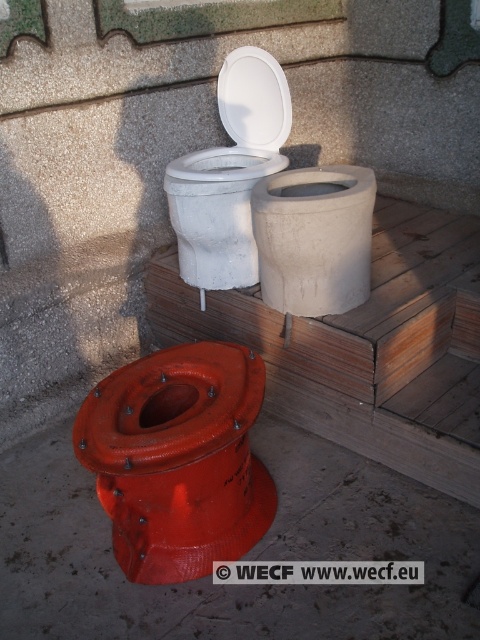
Question: Is orange glossy toilet bowl at lower center positioned behind white glossy toilet lid at upper center?

Choices:
 (A) no
 (B) yes

Answer: (A)

Question: In this image, where is white matte toilet bowl at upper center located relative to white glossy toilet lid at upper center?

Choices:
 (A) above
 (B) below

Answer: (B)

Question: Which point is farther to the camera?

Choices:
 (A) matte concrete toilet bowl at center
 (B) white glossy toilet lid at upper center
 (C) white matte toilet bowl at upper center

Answer: (B)

Question: Can you confirm if matte concrete toilet bowl at center is wider than white matte toilet bowl at upper center?

Choices:
 (A) yes
 (B) no

Answer: (B)

Question: Based on their relative distances, which object is nearer to the white matte toilet bowl at upper center?

Choices:
 (A) orange glossy toilet bowl at lower center
 (B) white glossy toilet lid at upper center
 (C) matte concrete toilet bowl at center

Answer: (C)

Question: Which object appears farthest from the camera in this image?

Choices:
 (A) white glossy toilet lid at upper center
 (B) orange glossy toilet bowl at lower center
 (C) matte concrete toilet bowl at center

Answer: (A)